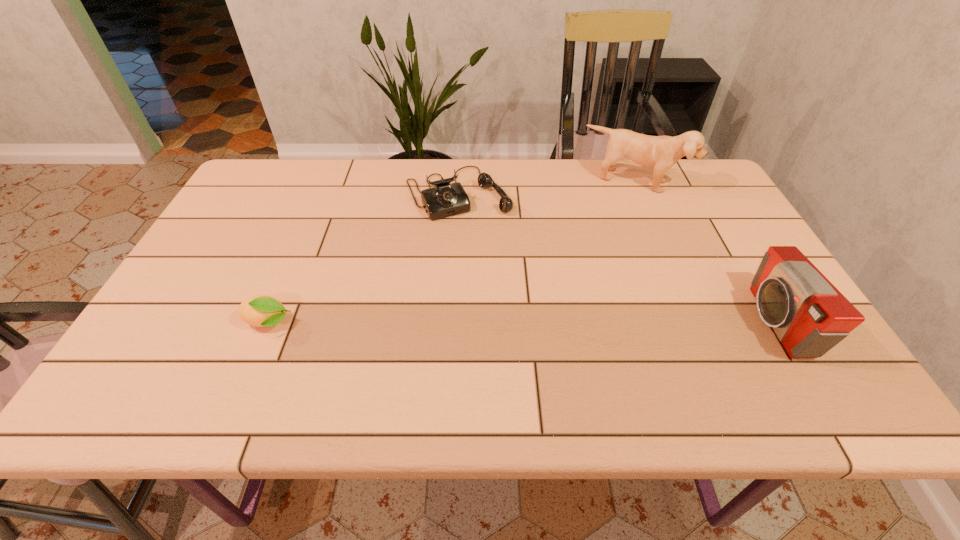
I want to click on vacant position located 0.170m on the dial of the third tallest object, so click(503, 258).

Where is `blank space located on the dial of the third tallest object`? Image resolution: width=960 pixels, height=540 pixels. blank space located on the dial of the third tallest object is located at coordinates (516, 278).

Identify the location of vacant area located on the dial of the third tallest object. The height and width of the screenshot is (540, 960). (492, 241).

Where is `free point located 0.300m on the left side of the tallest object`? The width and height of the screenshot is (960, 540). free point located 0.300m on the left side of the tallest object is located at coordinates (595, 261).

Locate an element on the screen. vacant space situated 0.060m on the left side of the tallest object is located at coordinates (616, 209).

Identify the location of blank area located 0.140m on the left side of the tallest object. (610, 225).

I want to click on telephone positioned at the far edge, so click(x=445, y=199).

Locate an element on the screen. The width and height of the screenshot is (960, 540). puppy that is at the far edge is located at coordinates (659, 152).

Locate an element on the screen. The width and height of the screenshot is (960, 540). lemon positioned at the near edge is located at coordinates click(263, 311).

Find the location of `camera that is at the near edge`. camera that is at the near edge is located at coordinates (809, 315).